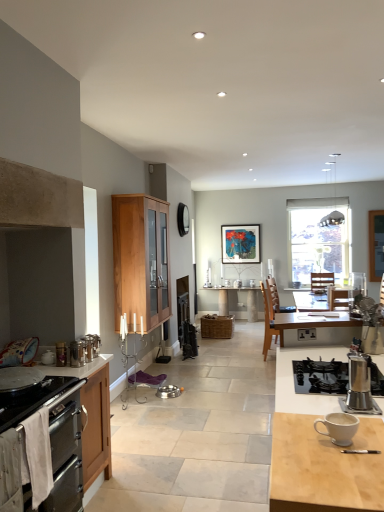
Where is `vacant space in front of metallic silver canister at left, the 2th kitchen appliance in the back-to-front sequence`? vacant space in front of metallic silver canister at left, the 2th kitchen appliance in the back-to-front sequence is located at coordinates (77, 371).